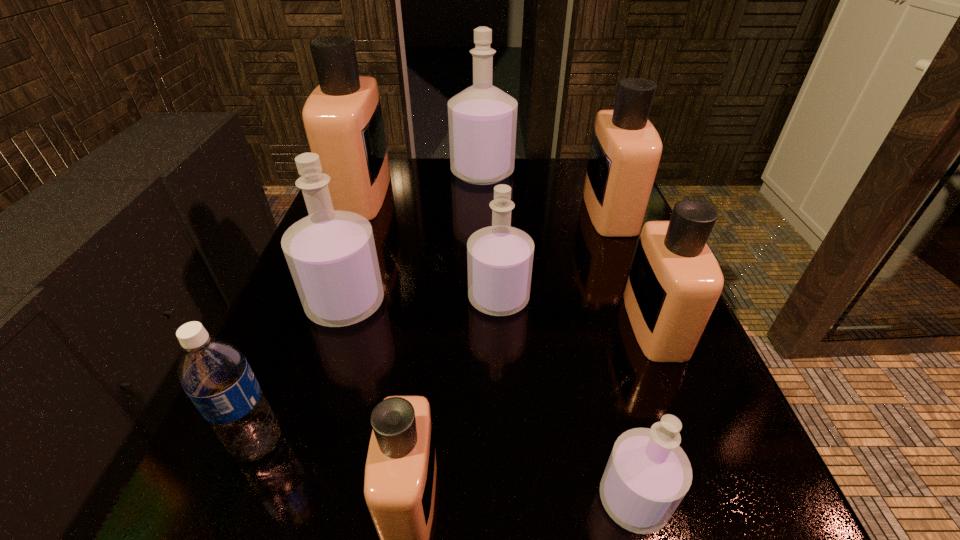
The width and height of the screenshot is (960, 540). In order to click on the farthest purple perfume in this screenshot , I will do `click(482, 119)`.

What are the coordinates of `the biggest beige perfume` in the screenshot? It's located at (342, 117).

You are a GUI agent. You are given a task and a screenshot of the screen. Output one action in this format:
    pyautogui.click(x=<x>, y=<y>)
    Task: Click on the second biggest beige perfume
    This screenshot has width=960, height=540.
    Given the screenshot: What is the action you would take?
    pyautogui.click(x=625, y=152)

The width and height of the screenshot is (960, 540). I want to click on the leftmost purple perfume, so click(x=331, y=254).

The height and width of the screenshot is (540, 960). Find the location of `the third biggest purple perfume`. the third biggest purple perfume is located at coordinates (499, 258).

This screenshot has height=540, width=960. Find the location of `the third biggest beige perfume`. the third biggest beige perfume is located at coordinates (675, 281).

Find the location of `water bottle`. water bottle is located at coordinates (213, 372).

Find the location of a particular element. The width and height of the screenshot is (960, 540). the sixth perfume from left to right is located at coordinates (648, 474).

Where is `the nearest purple perfume`? the nearest purple perfume is located at coordinates (648, 474).

Locate an element on the screen. free space located on the right of the biggest purple perfume is located at coordinates (542, 173).